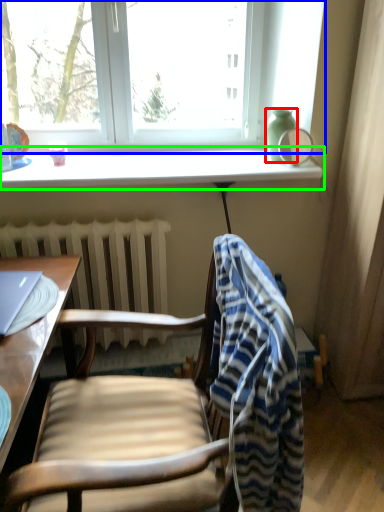
Question: Which is nearer to the vase (highlighted by a red box)? window (highlighted by a blue box) or window sill (highlighted by a green box).

Choices:
 (A) window
 (B) window sill

Answer: (B)